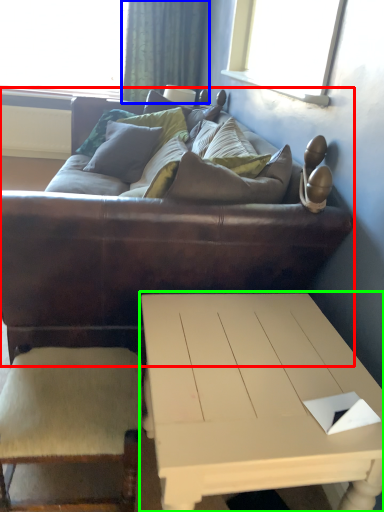
Question: Which object is the farthest from studio couch (highlighted by a red box)? Choose among these: curtain (highlighted by a blue box) or coffee table (highlighted by a green box).

Choices:
 (A) curtain
 (B) coffee table

Answer: (A)